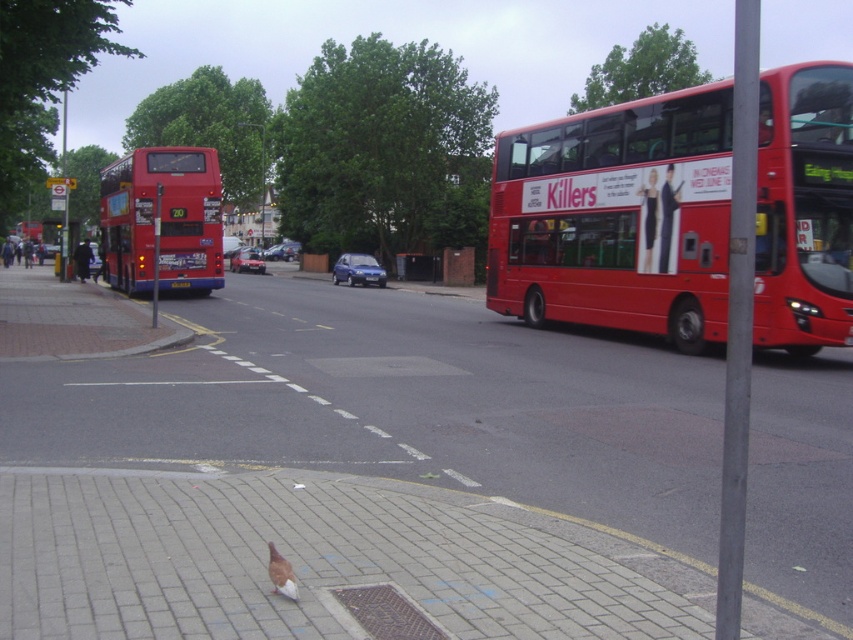
You are a pedestrian standing at the bus stop and want to board the first arriving bus. Which bus should you wait closer to, the red matte bus at right or the matte red bus at left?

The red matte bus at right is positioned under matte red bus at left, so the matte red bus at left is closer to the pedestrian at the bus stop. Therefore, you should wait closer to the matte red bus at left.

You are a delivery person who needs to place a 1.2 meter long package between the matte red bus at left and the brown feathered pigeon at lower center. Can the space between them accommodate the package?

The matte red bus at left is wider than the brown feathered pigeon at lower center, but the description does not provide the exact distance between them. Therefore, it is uncertain if the space between them can accommodate the 1.2 meter long package.